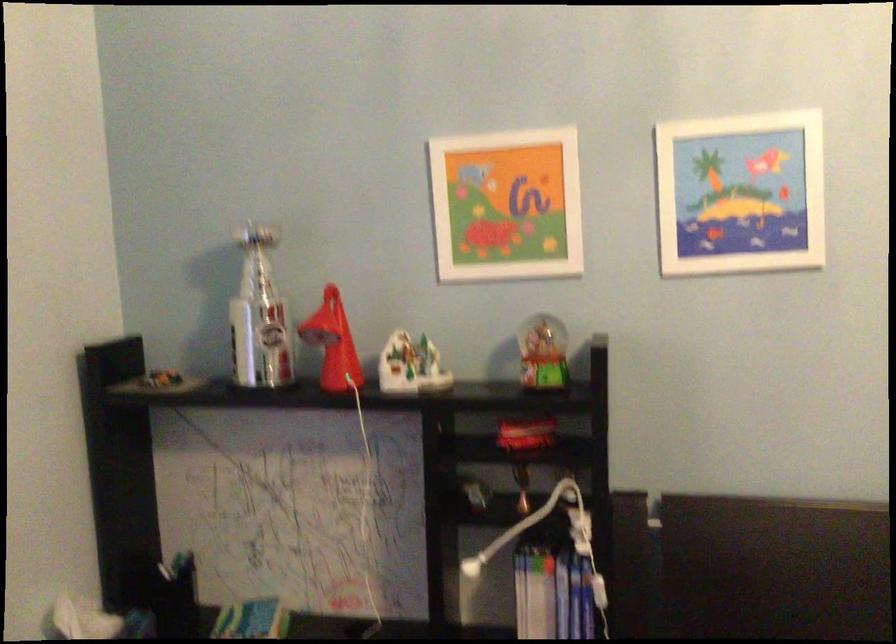
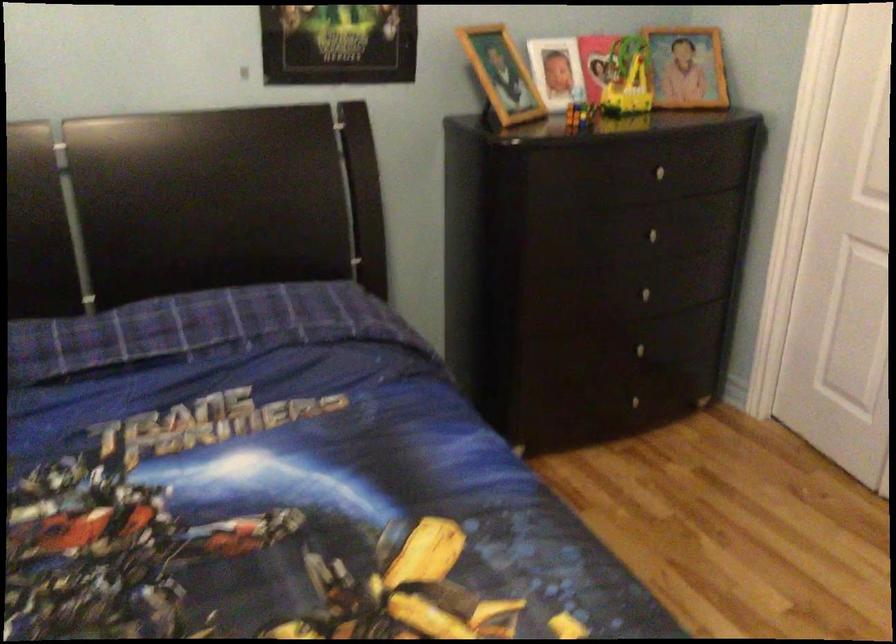
The images are taken continuously from a first-person perspective. In which direction is your viewpoint rotating?

The rotation direction of the camera is right-down.